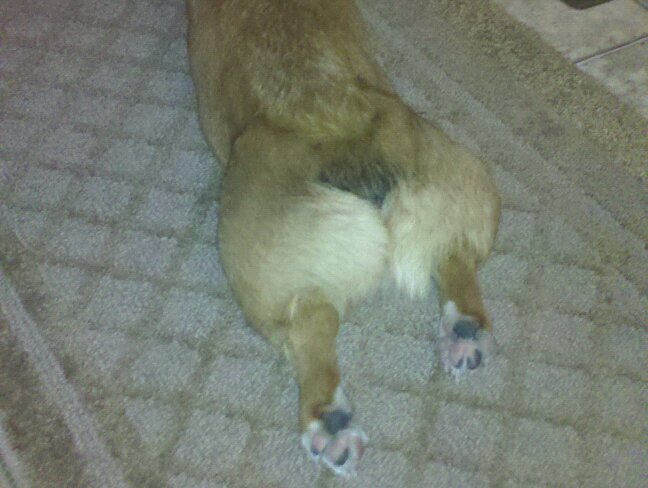
Where is `floor tile`? The height and width of the screenshot is (488, 648). floor tile is located at coordinates (592, 35), (629, 78), (643, 3).